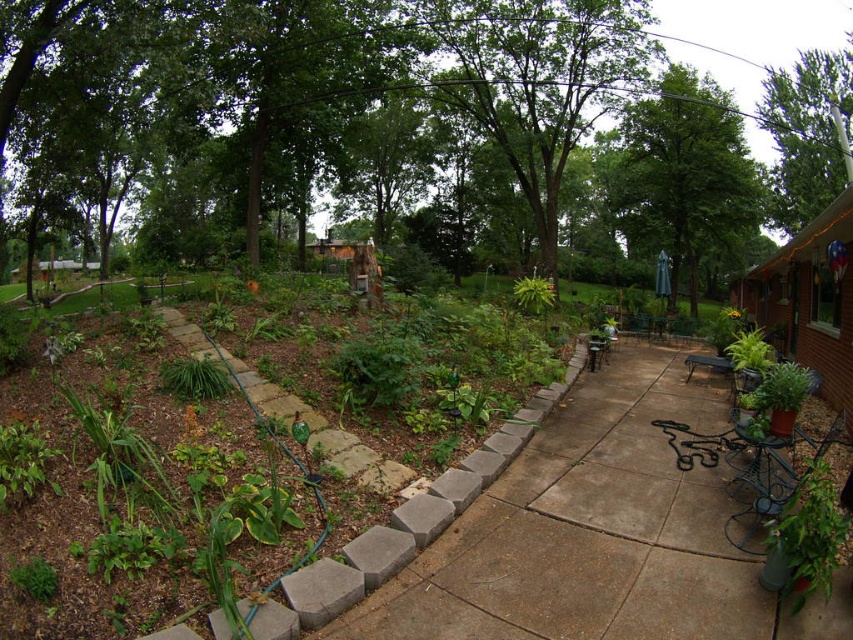
You are planning to place a large garden statue that requires a space larger than the brown concrete patio at center. Based on the scene, is there another area near the green leafy plant at lower right where the statue could fit?

The green leafy plant at lower right is larger than the brown concrete patio at center, so the area near the green leafy plant at lower right may have enough space to accommodate the statue.

You are standing on the brown concrete patio at center and want to water the green leafy plant at lower right using the garden hose. Which direction should you move to reach the plant?

The brown concrete patio at center is below the green leafy plant at lower right, so you should move upward to reach the plant.

You are planning to host a small gathering in the backyard and need to set up a table and chairs. Based on the image, which area would be more suitable for placing the setup, the brown concrete patio at center or the green leafy plant at lower left, and why?

The brown concrete patio at center is more suitable for placing the table and chairs because it occupies less space than the green leafy plant at lower left, making it a better area for setting up the gathering.